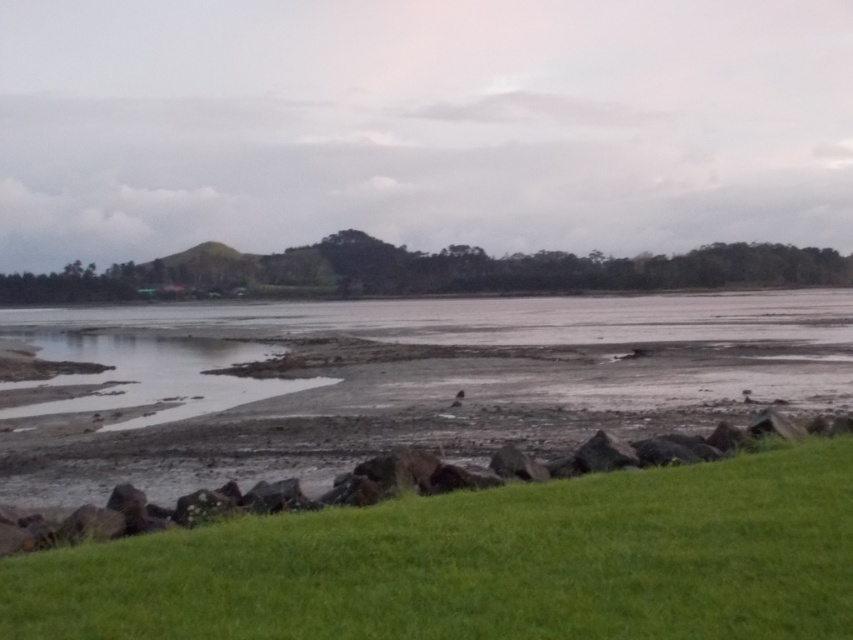
Question: Which of the following is the closest to the observer?

Choices:
 (A) muddy wetland at lower left
 (B) green grassy at lower right

Answer: (B)

Question: Observing the image, what is the correct spatial positioning of green grassy at lower right in reference to muddy wetland at lower left?

Choices:
 (A) below
 (B) above

Answer: (A)

Question: Can you confirm if green grassy at lower right is positioned to the right of muddy wetland at lower left?

Choices:
 (A) yes
 (B) no

Answer: (A)

Question: Can you confirm if green grassy at lower right is bigger than muddy wetland at lower left?

Choices:
 (A) no
 (B) yes

Answer: (A)